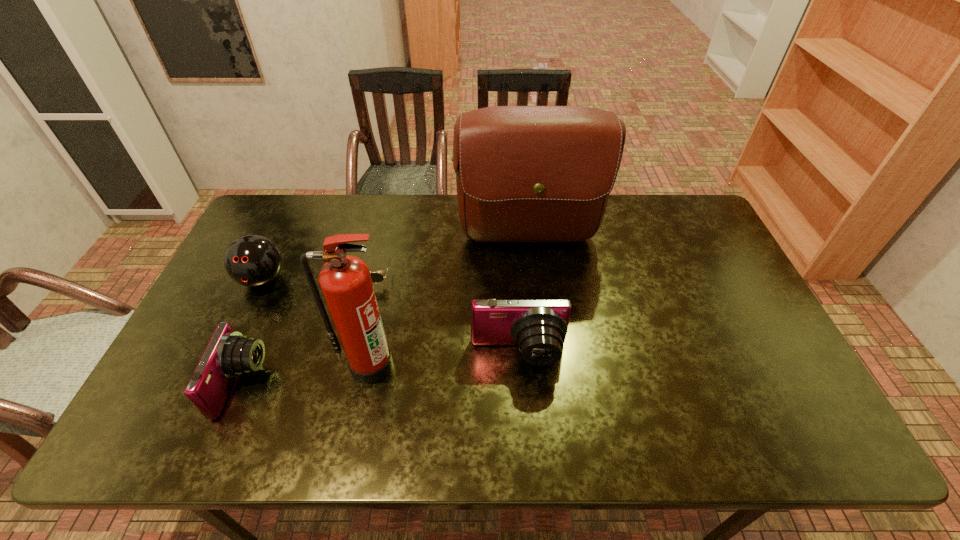
Locate an element on the screen. Image resolution: width=960 pixels, height=540 pixels. the fifth tallest object is located at coordinates pyautogui.click(x=228, y=354).

You are a GUI agent. You are given a task and a screenshot of the screen. Output one action in this format:
    pyautogui.click(x=<x>, y=<y>)
    Task: Click on the shorter camera
    The width and height of the screenshot is (960, 540).
    Given the screenshot: What is the action you would take?
    pyautogui.click(x=228, y=354)

Identify the location of the taller camera. This screenshot has height=540, width=960. (539, 326).

Image resolution: width=960 pixels, height=540 pixels. Identify the location of bowling ball. (252, 260).

The image size is (960, 540). Find the location of `satchel`. satchel is located at coordinates (523, 173).

Where is `the shortest object`? This screenshot has width=960, height=540. the shortest object is located at coordinates (376, 277).

This screenshot has width=960, height=540. I want to click on fire extinguisher, so click(x=345, y=280).

You are a GUI agent. You are given a task and a screenshot of the screen. Output one action in this format:
    pyautogui.click(x=<x>, y=<y>)
    Task: Click on the vacant space located on the front-facing side of the left camera
    
    Given the screenshot: What is the action you would take?
    pyautogui.click(x=306, y=383)

The width and height of the screenshot is (960, 540). What are the coordinates of `vacant space situated on the surface of the bowling ball near the finger holes` in the screenshot? It's located at (214, 383).

Identify the location of vacant space located 0.090m on the open flap of the satchel. This screenshot has width=960, height=540. (534, 287).